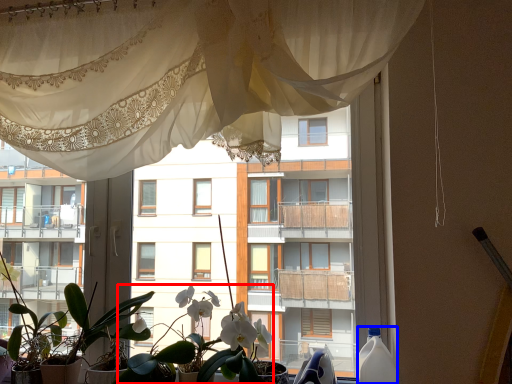
Question: Among these objects, which one is farthest to the camera, floral arrangement (highlighted by a red box) or bottle (highlighted by a blue box)?

Choices:
 (A) floral arrangement
 (B) bottle

Answer: (A)